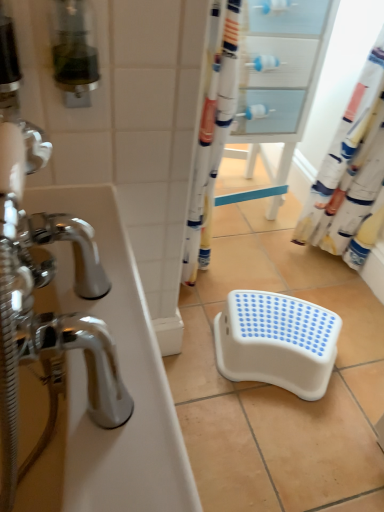
You are a GUI agent. You are given a task and a screenshot of the screen. Output one action in this format:
    pyautogui.click(x=<x>, y=<y>)
    Task: Click on the free location above white plastic step stool at center (from a real-world perspective)
    Image resolution: width=384 pixels, height=512 pixels.
    Given the screenshot: What is the action you would take?
    pyautogui.click(x=287, y=324)